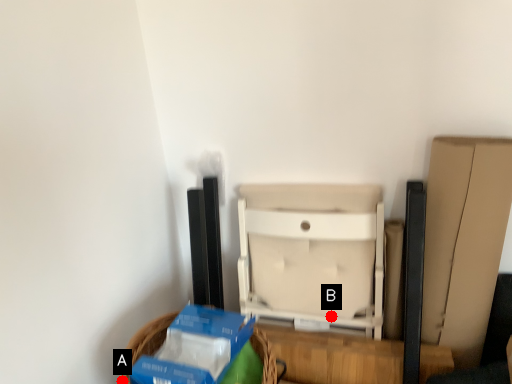
Question: Two points are circled on the image, labeled by A and B beside each circle. Which of the following is the farthest from the observer?

Choices:
 (A) A is further
 (B) B is further

Answer: (B)